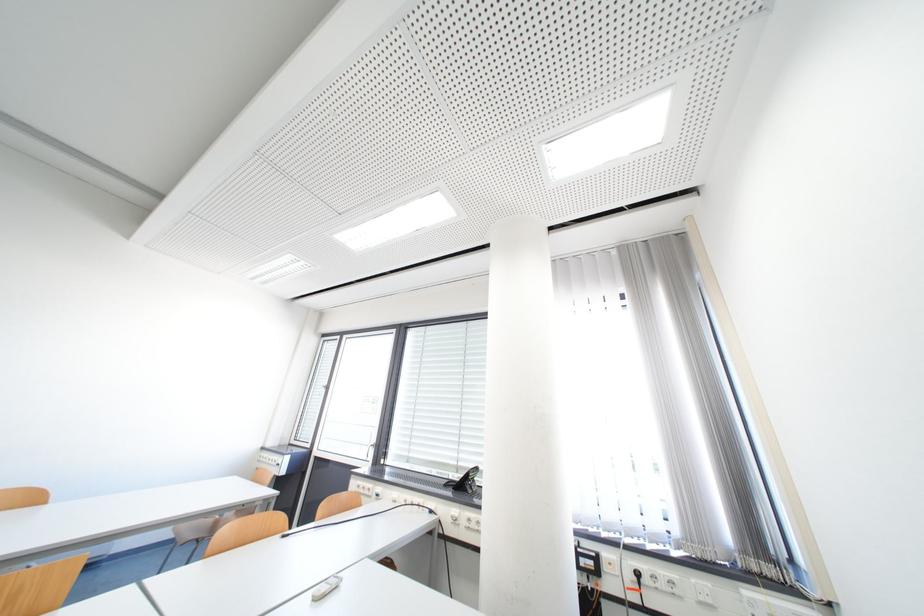
Locate an element on the screen. Image resolution: width=924 pixels, height=616 pixels. window handle is located at coordinates (378, 469).